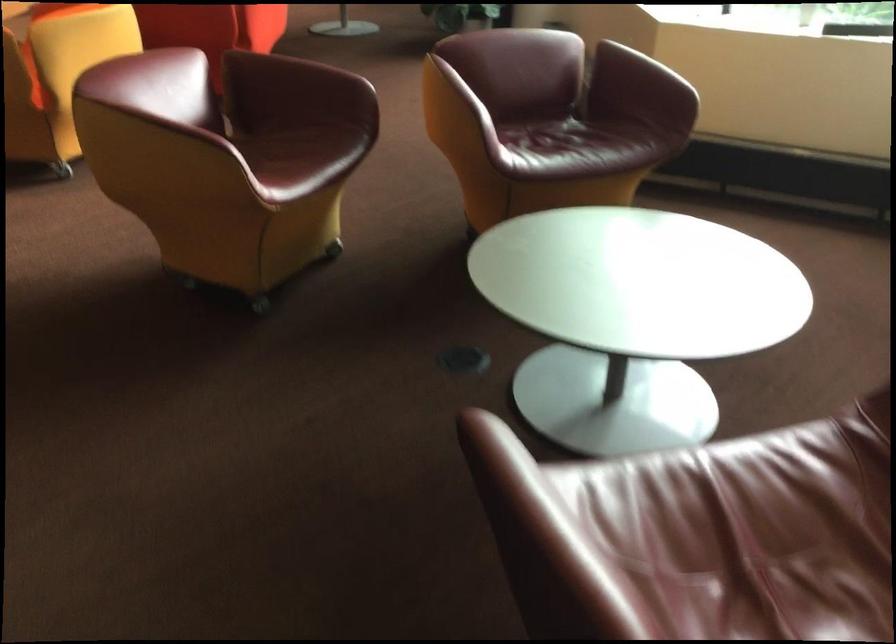
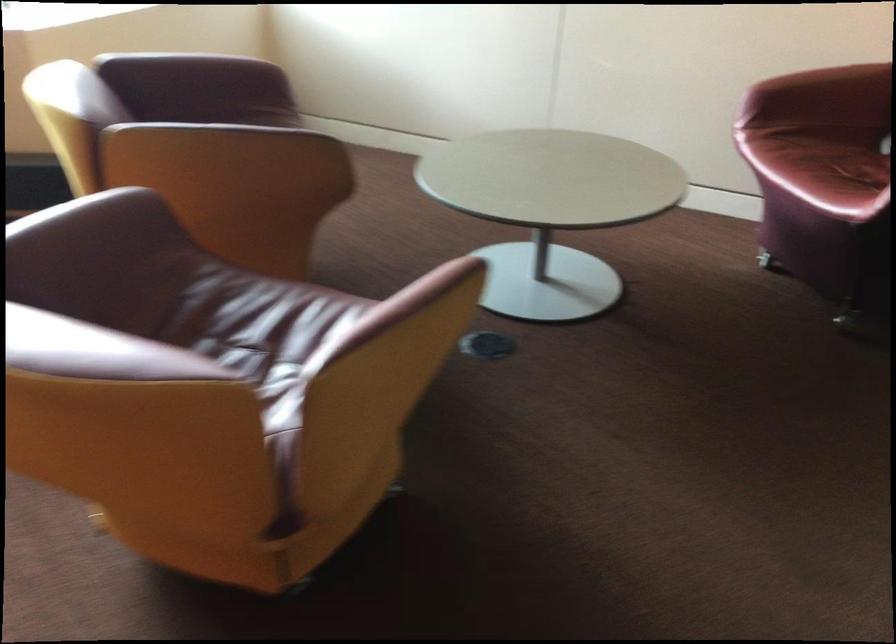
Question: I am providing you with two images of the same scene from different viewpoints. After the viewpoint changes to image2, which objects are now occluded?

Choices:
 (A) red chair armrest
 (B) brown chair sitting surface
 (C) red chair sitting surface
 (D) pink ring binder

Answer: (A)